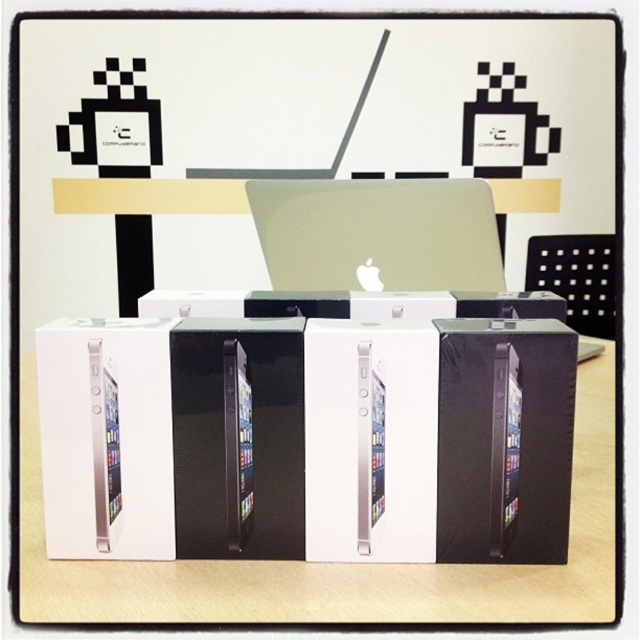
Between white cardboard boxes at center and satin silver laptop at center, which one is positioned higher?

Positioned higher is satin silver laptop at center.

Which is in front, point (497, 612) or point (445, 209)?

Point (497, 612)

At what (x,y) coordinates should I click in order to perform the action: click on white cardboard boxes at center. Please return your answer as a coordinate pair (x, y). The height and width of the screenshot is (640, 640). Looking at the image, I should click on (339, 564).